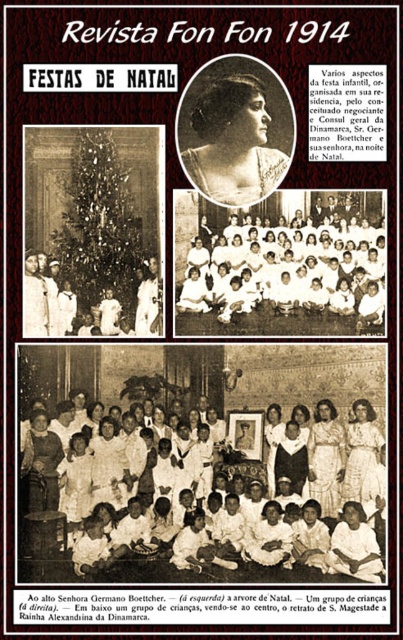
Question: Does matte black portrait at upper center have a lesser width compared to white lace dress at center?

Choices:
 (A) yes
 (B) no

Answer: (B)

Question: Which object appears closest to the camera in this image?

Choices:
 (A) black satin dress at center
 (B) white lace dress at center

Answer: (B)

Question: Which point is farther to the camera?

Choices:
 (A) white lace dress at center
 (B) black satin dress at center

Answer: (B)

Question: Can you confirm if white satin dress at center is positioned to the right of white lace dress at center?

Choices:
 (A) no
 (B) yes

Answer: (A)

Question: Which object is closer to the camera taking this photo?

Choices:
 (A) white lace dress at center
 (B) white satin dress at center
 (C) matte black portrait at upper center

Answer: (A)

Question: Does matte black portrait at upper center have a smaller size compared to white lace dress at center?

Choices:
 (A) no
 (B) yes

Answer: (A)